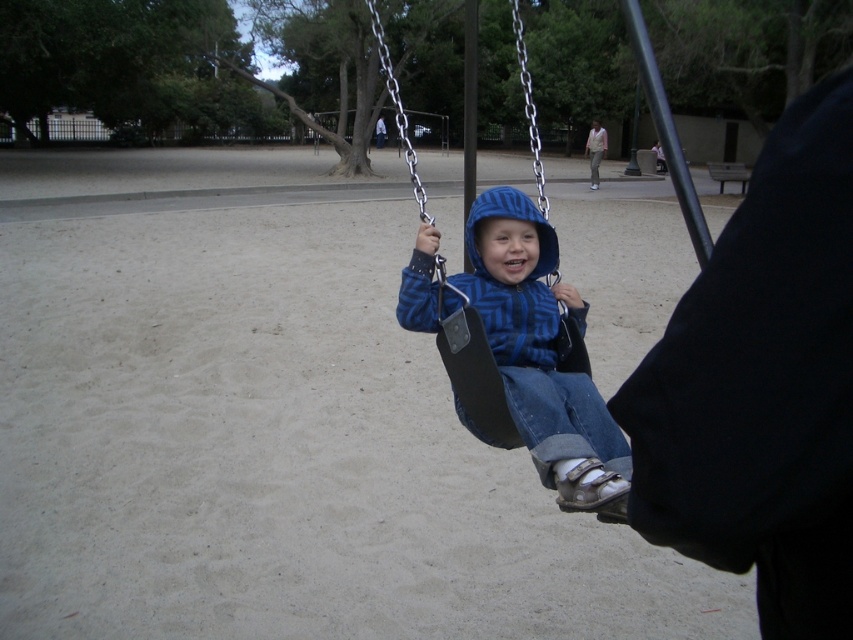
You are a parent watching your child play. You see the blue fleece hoodie at center and the black plastic swing at center. Which item is shorter in height?

The blue fleece hoodie at center is shorter in height compared to the black plastic swing at center.

You are a parent at the playground and want to ensure your child stays warm. The blue fleece hoodie at center is currently on the child sitting in the black plastic swing at center. If you want to place another similar hoodie next to it on the swing, will there be enough space?

The blue fleece hoodie at center has a lesser width compared to black plastic swing at center, so placing another similar hoodie next to it should be possible as the swing is wider than the hoodie.

You are a photographer trying to capture the child in the swing. You notice the blue fleece hoodie at center and the black plastic swing at center. Which object is positioned closer to you?

The blue fleece hoodie at center is closer to the viewer than the black plastic swing at center.